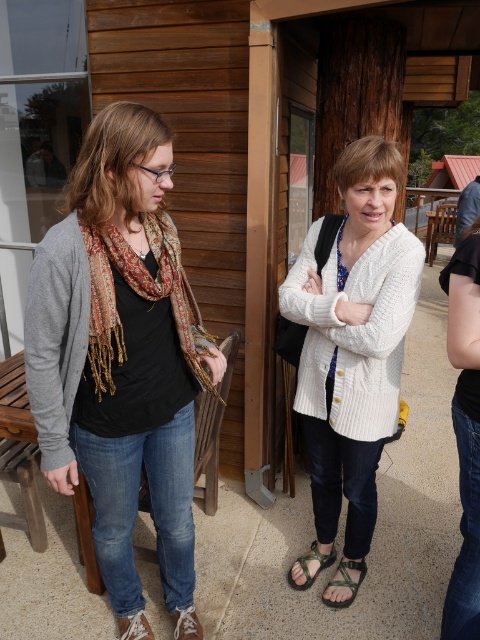
Question: Which of the following is the farthest from the observer?

Choices:
 (A) (352, 490)
 (B) (310, 548)

Answer: (B)

Question: Considering the relative positions of matte black scarf at left and white knitted cardigan at center in the image provided, where is matte black scarf at left located with respect to white knitted cardigan at center?

Choices:
 (A) above
 (B) below

Answer: (B)

Question: Does matte black scarf at left lie in front of green fabric sandal at lower center?

Choices:
 (A) no
 (B) yes

Answer: (B)

Question: Does printed silk scarf at left appear over green fabric sandal at lower center?

Choices:
 (A) no
 (B) yes

Answer: (B)

Question: Estimate the real-world distances between objects in this image. Which object is farther from the camouflage fabric sandal at lower center?

Choices:
 (A) printed silk scarf at left
 (B) white knitted cardigan at center
 (C) green fabric sandal at lower center
 (D) matte black scarf at left

Answer: (A)

Question: Which object is positioned farthest from the camouflage fabric sandal at lower center?

Choices:
 (A) white knitted cardigan at center
 (B) printed silk scarf at left
 (C) green fabric sandal at lower center
 (D) matte black scarf at left

Answer: (B)